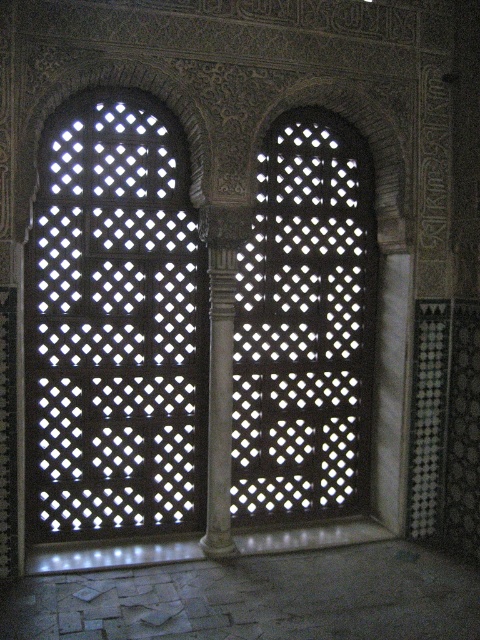
Question: From the image, what is the correct spatial relationship of translucent glass lattice at center in relation to white marble column at center?

Choices:
 (A) right
 (B) left

Answer: (A)

Question: Which object appears closest to the camera in this image?

Choices:
 (A) translucent glass lattice at left
 (B) translucent glass lattice at center
 (C) white marble column at center

Answer: (A)

Question: Which of these objects is positioned closest to the translucent glass lattice at left?

Choices:
 (A) white marble column at center
 (B) translucent glass lattice at center

Answer: (A)

Question: Which point is closer to the camera?

Choices:
 (A) (307, 442)
 (B) (229, 362)

Answer: (B)

Question: Is translucent glass lattice at center to the left of white marble column at center from the viewer's perspective?

Choices:
 (A) yes
 (B) no

Answer: (B)

Question: Does translucent glass lattice at left have a greater width compared to translucent glass lattice at center?

Choices:
 (A) yes
 (B) no

Answer: (A)